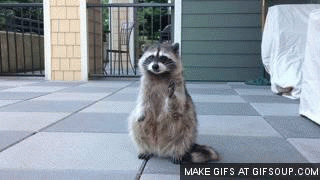
Where is `white sheet`? The image size is (320, 180). white sheet is located at coordinates (282, 32).